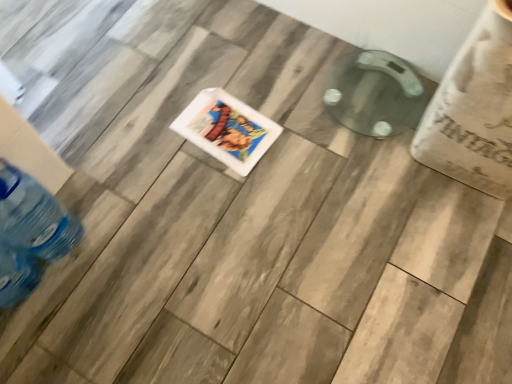
Find the location of `free space behind translucent plastic bottle at lower left`. free space behind translucent plastic bottle at lower left is located at coordinates (91, 183).